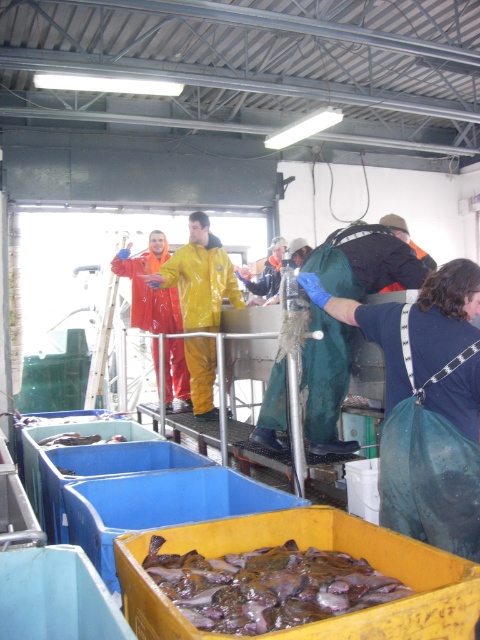
The height and width of the screenshot is (640, 480). What do you see at coordinates (427, 404) in the screenshot?
I see `green waterproof suit at center` at bounding box center [427, 404].

This screenshot has height=640, width=480. In order to click on green waterproof suit at center in this screenshot , I will do tap(427, 404).

From the picture: Who is lower down, purple rubber fish at lower center or yellow waterproof suit at center?

Positioned lower is purple rubber fish at lower center.

Can you confirm if purple rubber fish at lower center is shorter than yellow waterproof suit at center?

Correct, purple rubber fish at lower center is not as tall as yellow waterproof suit at center.

Is point (236, 563) positioned after point (213, 316)?

No, it is in front of (213, 316).

Locate an element on the screen. This screenshot has width=480, height=640. purple rubber fish at lower center is located at coordinates (267, 586).

Is yellow waterproof suit at center below orange waterproof suit at center?

Yes.

Who is more forward, (180, 298) or (171, 406)?

Point (180, 298) is in front.

This screenshot has height=640, width=480. What do you see at coordinates (200, 276) in the screenshot?
I see `yellow waterproof suit at center` at bounding box center [200, 276].

This screenshot has height=640, width=480. Identify the location of yellow waterproof suit at center. (200, 276).